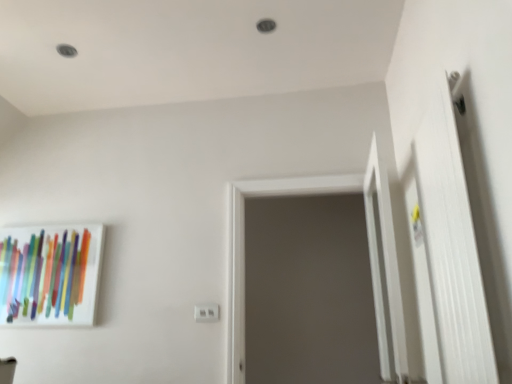
Question: Can matte glass picture frame at left be found inside white matte door at right?

Choices:
 (A) yes
 (B) no

Answer: (B)

Question: Would you say white matte door at right is outside matte glass picture frame at left?

Choices:
 (A) yes
 (B) no

Answer: (A)

Question: Is white matte door at right thinner than matte glass picture frame at left?

Choices:
 (A) yes
 (B) no

Answer: (B)

Question: From a real-world perspective, is white matte door at right on matte glass picture frame at left?

Choices:
 (A) no
 (B) yes

Answer: (A)

Question: Could you tell me if white matte door at right is facing matte glass picture frame at left?

Choices:
 (A) no
 (B) yes

Answer: (A)

Question: Does white matte door at right appear on the right side of matte glass picture frame at left?

Choices:
 (A) yes
 (B) no

Answer: (A)

Question: Can you confirm if white matte door at right is thinner than gray matte screen door at center?

Choices:
 (A) yes
 (B) no

Answer: (A)

Question: Is white matte door at right behind gray matte screen door at center?

Choices:
 (A) no
 (B) yes

Answer: (A)

Question: Are white matte door at right and gray matte screen door at center far apart?

Choices:
 (A) yes
 (B) no

Answer: (B)

Question: From the image's perspective, is white matte door at right below gray matte screen door at center?

Choices:
 (A) no
 (B) yes

Answer: (A)

Question: Is white matte door at right looking in the opposite direction of gray matte screen door at center?

Choices:
 (A) no
 (B) yes

Answer: (A)

Question: From a real-world perspective, is white matte door at right positioned under gray matte screen door at center based on gravity?

Choices:
 (A) yes
 (B) no

Answer: (A)

Question: From a real-world perspective, is white plastic electric outlet at center located higher than white matte door at right?

Choices:
 (A) no
 (B) yes

Answer: (A)